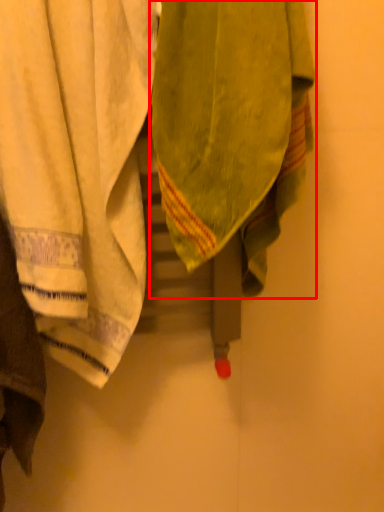
Question: From the image's perspective, considering the relative positions of towel (annotated by the red box) and towel in the image provided, where is towel (annotated by the red box) located with respect to the staircase?

Choices:
 (A) above
 (B) below

Answer: (A)